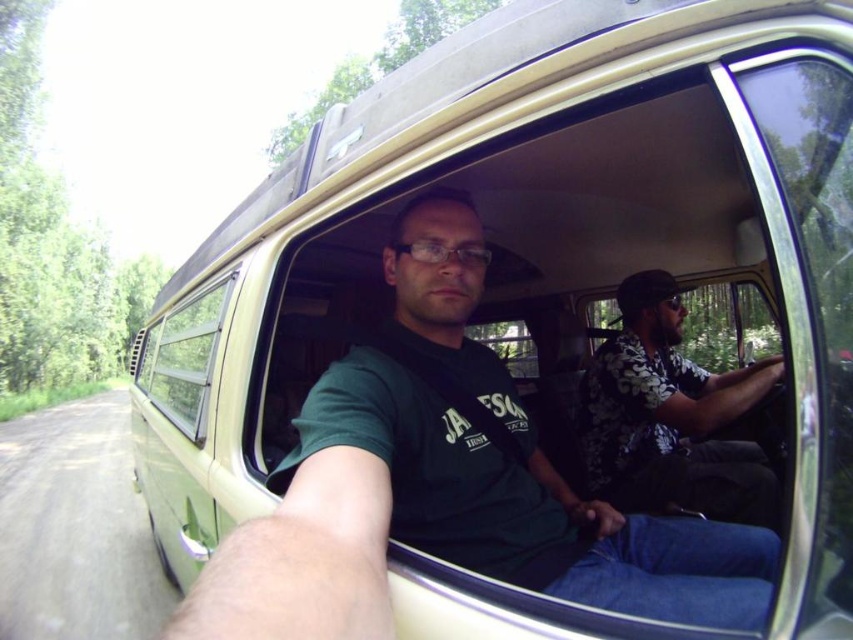
You are a passenger in the vintage van and need to hand a map to the driver. The map is currently on the green matte shirt at center. Based on its location, can you determine if the driver can easily reach it without leaving their seat?

The green matte shirt at center is located at point coordinates that are not specified in terms of spatial relation to the driver. However, since the shirt is at the center of the van, it might be positioned in a central seating area. Without precise spatial details like distance or direction from the driver, it is unclear if the driver can easily reach the map. Please provide more information about the shirt and driver positions.

You are sitting in the back of the van and want to talk to the driver. Which object, the floral shirt at center or the clear glass window at center, is closer to your left side?

The clear glass window at center is closer to your left side because the floral shirt at center is positioned on the right side of it.

You are a passenger in the vintage van and want to hand a map to the driver wearing the floral shirt at center. Since you are wearing the green matte shirt at center, can you reach the driver directly without moving your seat forward?

The green matte shirt at center is in front of the floral shirt at center, meaning you are sitting in front of the driver. Therefore, you can reach the driver directly without moving your seat forward.